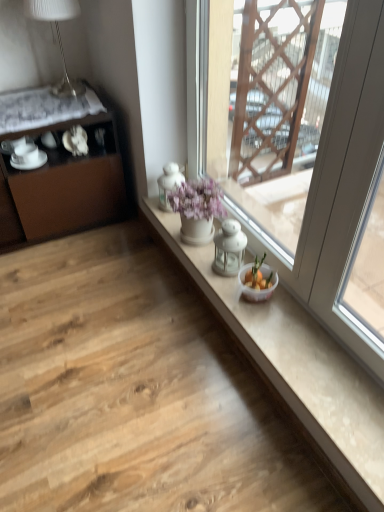
Question: Is white glossy table lamp at upper left further to camera compared to brown matte cabinet at left?

Choices:
 (A) yes
 (B) no

Answer: (A)

Question: Does white glossy table lamp at upper left have a smaller size compared to brown matte cabinet at left?

Choices:
 (A) no
 (B) yes

Answer: (B)

Question: From a real-world perspective, does white glossy table lamp at upper left stand above brown matte cabinet at left?

Choices:
 (A) no
 (B) yes

Answer: (B)

Question: Does white glossy table lamp at upper left turn towards brown matte cabinet at left?

Choices:
 (A) no
 (B) yes

Answer: (A)

Question: Is white glossy table lamp at upper left surrounding brown matte cabinet at left?

Choices:
 (A) yes
 (B) no

Answer: (B)

Question: From a real-world perspective, is white glossy table lamp at upper left physically below brown matte cabinet at left?

Choices:
 (A) no
 (B) yes

Answer: (A)

Question: Does white porcelain saucer at left, the 1th tableware from the right, lie behind white glass window at center?

Choices:
 (A) yes
 (B) no

Answer: (A)

Question: Does white porcelain saucer at left, the 1th tableware from the right, have a greater width compared to white glass window at center?

Choices:
 (A) yes
 (B) no

Answer: (A)

Question: Does white porcelain saucer at left, which appears as the 2th tableware when viewed from the left, have a lesser height compared to white glass window at center?

Choices:
 (A) no
 (B) yes

Answer: (B)

Question: Considering the relative sizes of white porcelain saucer at left, the 1th tableware from the right, and white glass window at center in the image provided, is white porcelain saucer at left, the 1th tableware from the right, taller than white glass window at center?

Choices:
 (A) yes
 (B) no

Answer: (B)

Question: Does white porcelain saucer at left, the 1th tableware from the right, have a lesser width compared to white glass window at center?

Choices:
 (A) yes
 (B) no

Answer: (B)

Question: Is white porcelain saucer at left, which appears as the 2th tableware when viewed from the left, directly adjacent to white glass window at center?

Choices:
 (A) yes
 (B) no

Answer: (B)

Question: From a real-world perspective, is white glass window at center physically above brown matte cabinet at left?

Choices:
 (A) yes
 (B) no

Answer: (A)